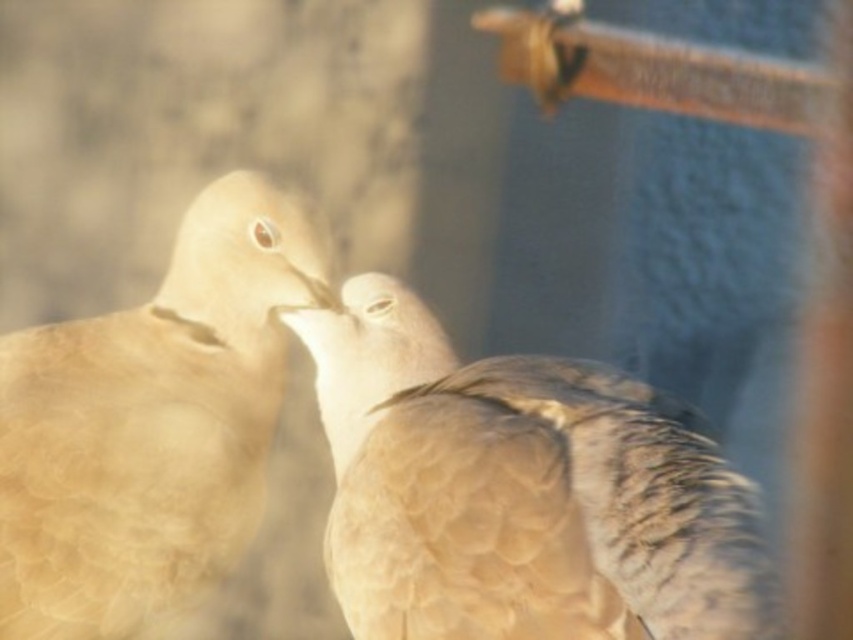
Is brown feathered bird at center positioned before matte beige bird at center?

Yes, it is.

Which is above, brown feathered bird at center or matte beige bird at center?

matte beige bird at center is higher up.

Between point (556, 422) and point (38, 602), which one is positioned behind?

The point (38, 602) is behind.

Where is `brown feathered bird at center`? Image resolution: width=853 pixels, height=640 pixels. brown feathered bird at center is located at coordinates (520, 492).